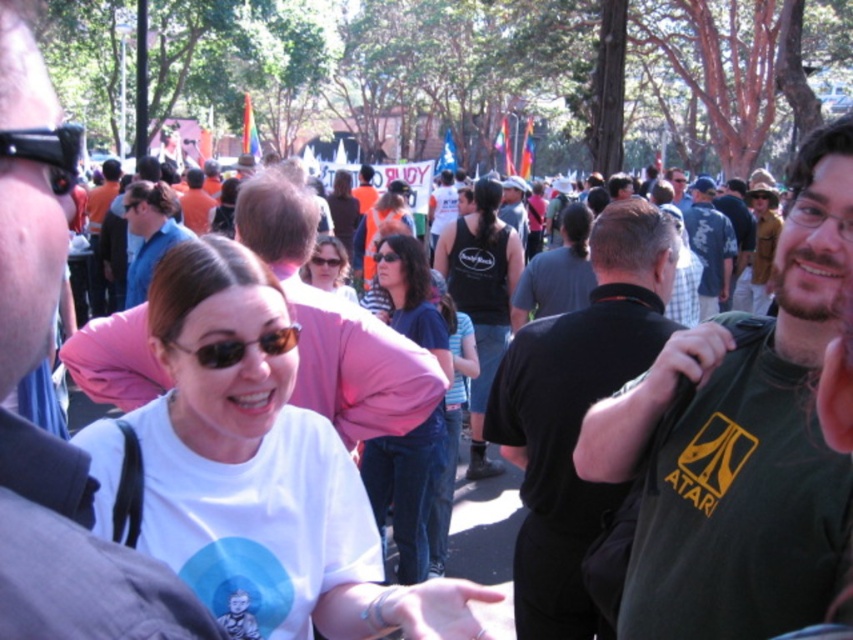
Can you confirm if black tank top at center is positioned above matte blue shirt at center?

Incorrect, black tank top at center is not positioned above matte blue shirt at center.

Is black tank top at center positioned before matte blue shirt at center?

That is True.

This screenshot has height=640, width=853. I want to click on black tank top at center, so click(480, 296).

Where is `black tank top at center`? black tank top at center is located at coordinates [480, 296].

Does green matte shirt at center appear on the right side of white matte t-shirt at center?

Correct, you'll find green matte shirt at center to the right of white matte t-shirt at center.

Is green matte shirt at center below white matte t-shirt at center?

Incorrect, green matte shirt at center is not positioned below white matte t-shirt at center.

Who is more forward, (x=717, y=499) or (x=386, y=616)?

Positioned in front is point (x=386, y=616).

At what (x,y) coordinates should I click in order to perform the action: click on green matte shirt at center. Please return your answer as a coordinate pair (x, y). Looking at the image, I should click on (741, 442).

Where is `matte black camera at left`? Image resolution: width=853 pixels, height=640 pixels. matte black camera at left is located at coordinates (74, 554).

Consider the image. Who is more distant from viewer, (28, 96) or (193, 205)?

Positioned behind is point (193, 205).

Does point (18, 116) lie in front of point (198, 180)?

Yes, it is.

Where is `matte black camera at left`? matte black camera at left is located at coordinates (74, 554).